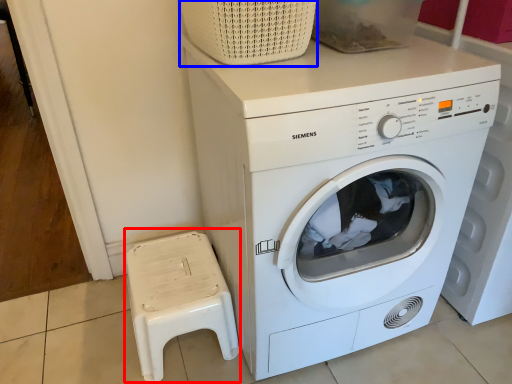
Question: Among these objects, which one is nearest to the camera, music stool (highlighted by a red box) or basket (highlighted by a blue box)?

Choices:
 (A) music stool
 (B) basket

Answer: (B)